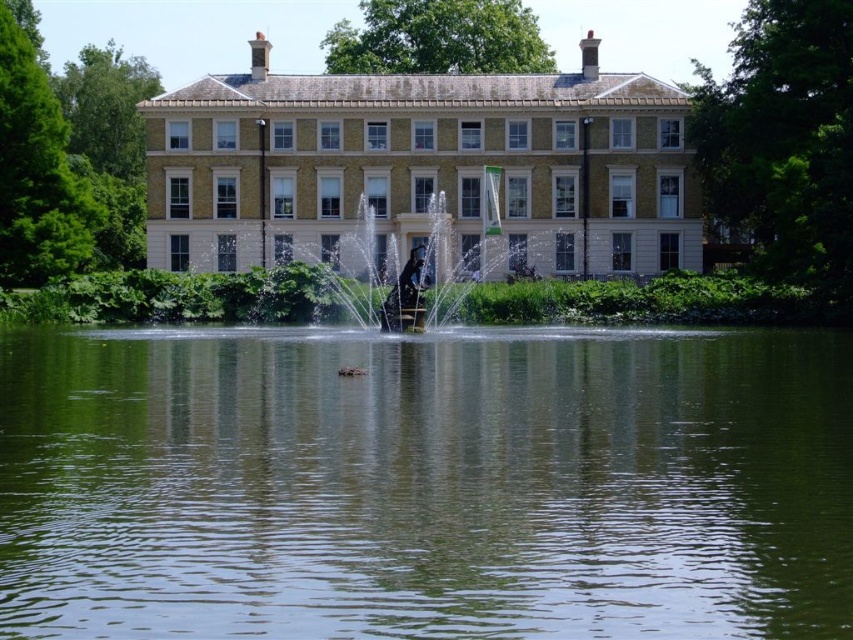
Question: In this image, where is green liquid water at center located relative to beige stone mansion at center?

Choices:
 (A) below
 (B) above

Answer: (A)

Question: Among these points, which one is farthest from the camera?

Choices:
 (A) (454, 100)
 (B) (848, 529)

Answer: (A)

Question: Which is farther from the beige stone mansion at center?

Choices:
 (A) polished bronze statue at center
 (B) green liquid water at center

Answer: (B)

Question: Which of these objects is positioned closest to the polished bronze statue at center?

Choices:
 (A) green liquid water at center
 (B) beige stone mansion at center

Answer: (B)

Question: Does green liquid water at center come behind polished bronze statue at center?

Choices:
 (A) no
 (B) yes

Answer: (A)

Question: Does beige stone mansion at center appear on the right side of polished bronze statue at center?

Choices:
 (A) yes
 (B) no

Answer: (B)